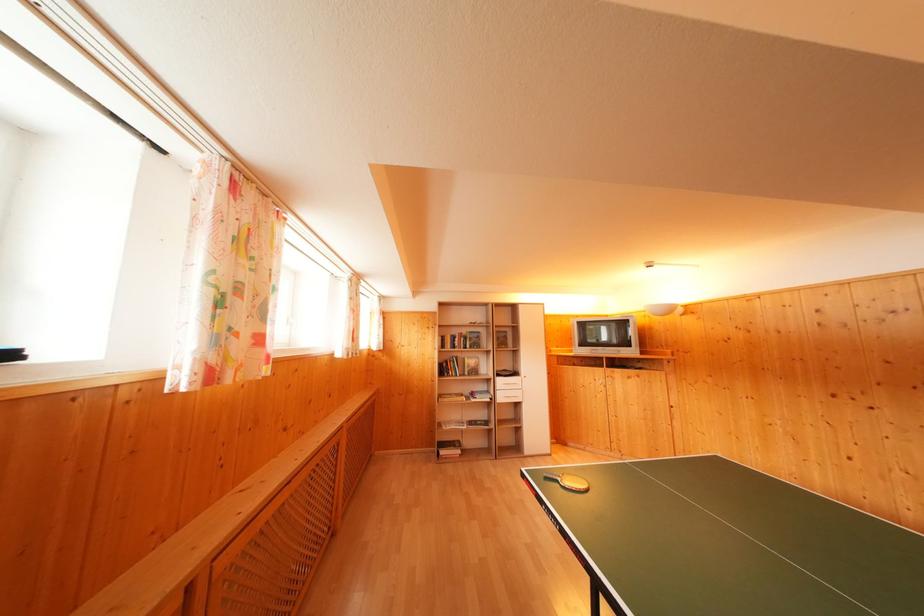
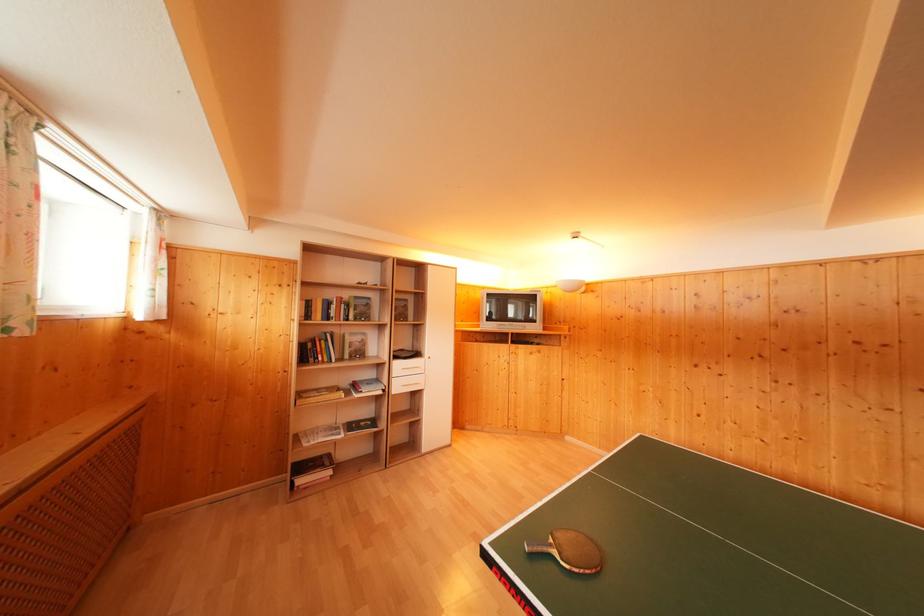
The point at (x=487, y=419) is marked in the first image. Where is the corresponding point in the second image?

(371, 416)